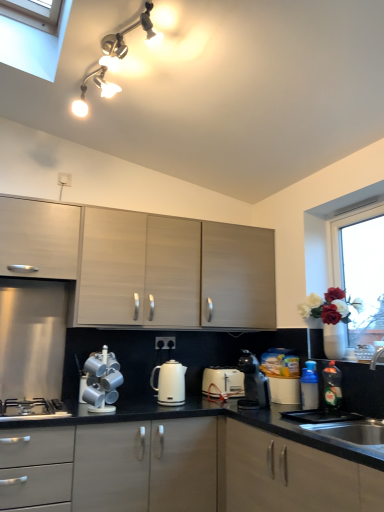
Question: Based on their sizes in the image, would you say white glossy vase at right is bigger or smaller than silver metallic mugs at lower center, which ranks as the first appliance in front-to-back order?

Choices:
 (A) big
 (B) small

Answer: (B)

Question: Considering the positions of white glossy vase at right and silver metallic mugs at lower center, which is the second appliance from right to left, in the image, is white glossy vase at right taller or shorter than silver metallic mugs at lower center, which is the second appliance from right to left,?

Choices:
 (A) short
 (B) tall

Answer: (A)

Question: Which object is positioned farthest from the green glossy bottle at lower right, acting as the first bottle starting from the right?

Choices:
 (A) silver metallic mugs at lower center, positioned as the second appliance in back-to-front order
 (B) black plastic coffee maker at center, the 1th kitchen appliance in the right-to-left sequence
 (C) blue plastic bottle at lower right, placed as the 1th bottle when sorted from left to right
 (D) matte gray cabinets at center, which is counted as the third cabinetry, starting from the top
 (E) white glossy electric kettle at center, which is the 1th kitchen appliance in left-to-right order

Answer: (A)

Question: Based on their relative distances, which object is nearer to the white plastic electric outlet at upper center, placed as the 1th electric outlet when sorted from front to back?

Choices:
 (A) matte gray cabinets at center, which ranks as the first cabinetry in bottom-to-top order
 (B) matte white cabinet at upper left, the first cabinetry in the top-to-bottom sequence
 (C) black plastic coffee maker at center, which is the 2th kitchen appliance from left to right
 (D) black matte gas stove at lower left
 (E) white plastic electric outlet at center, the 2th electric outlet positioned from the left

Answer: (B)